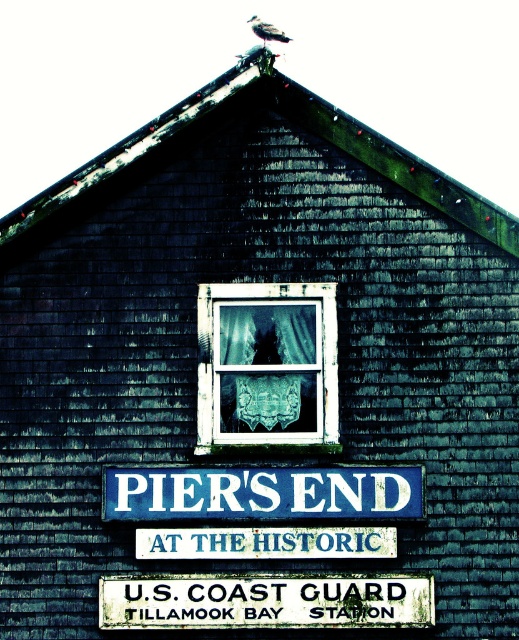
Question: Is white lace curtain at center above blue painted wood sign at center?

Choices:
 (A) yes
 (B) no

Answer: (A)

Question: Can you confirm if blue painted wood at center is thinner than blue painted wood sign at center?

Choices:
 (A) no
 (B) yes

Answer: (A)

Question: In this image, where is blue painted wood at center located relative to blue painted wood sign at center?

Choices:
 (A) above
 (B) below

Answer: (A)

Question: Considering the real-world distances, which object is closest to the blue painted wood sign at center?

Choices:
 (A) white lace curtain at center
 (B) white painted wood at bottom

Answer: (B)

Question: Which point is farther to the camera?

Choices:
 (A) white painted wood at bottom
 (B) blue painted wood sign at center
 (C) blue painted wood at center
 (D) white lace curtain at center

Answer: (D)

Question: Among these points, which one is nearest to the camera?

Choices:
 (A) (363, 476)
 (B) (337, 618)
 (C) (282, 545)

Answer: (B)